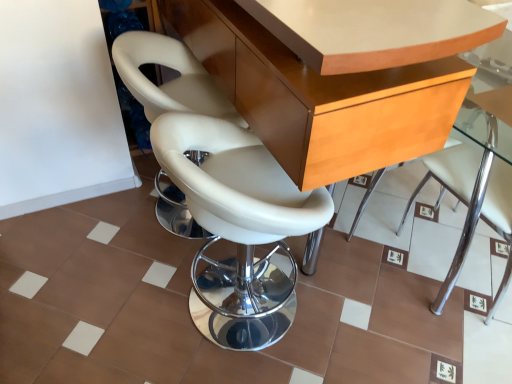
You are a GUI agent. You are given a task and a screenshot of the screen. Output one action in this format:
    pyautogui.click(x=<x>, y=<y>)
    Task: Click on the blank space to the left of white leather chair at center, which is counted as the first chair, starting from the left
    
    Given the screenshot: What is the action you would take?
    pyautogui.click(x=91, y=230)